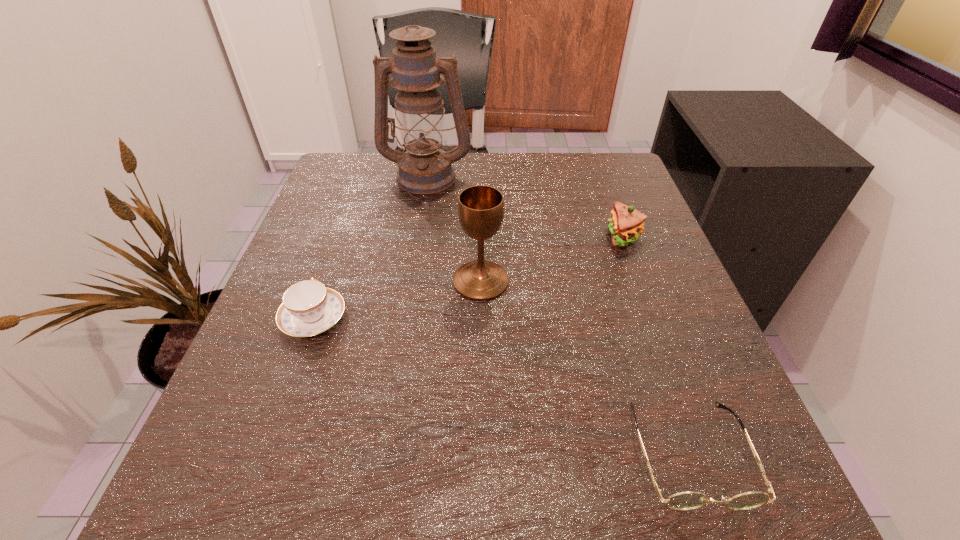
Find the location of `the tallest object`. the tallest object is located at coordinates (425, 169).

Where is `the farthest object`? Image resolution: width=960 pixels, height=540 pixels. the farthest object is located at coordinates (425, 169).

You are a GUI agent. You are given a task and a screenshot of the screen. Output one action in this format:
    pyautogui.click(x=<x>, y=<y>)
    Task: Click on the chalice
    
    Given the screenshot: What is the action you would take?
    pyautogui.click(x=480, y=208)

At what (x,y) coordinates should I click in order to perform the action: click on sandwich. Please return your answer as a coordinate pair (x, y). Image resolution: width=960 pixels, height=540 pixels. Looking at the image, I should click on (626, 224).

Identify the location of the third tallest object. The height and width of the screenshot is (540, 960). tap(626, 224).

This screenshot has width=960, height=540. In order to click on the second shortest object in this screenshot , I will do `click(309, 308)`.

Find the location of a particular element. This screenshot has width=960, height=540. spectacles is located at coordinates (685, 500).

What are the coordinates of `the shortest object` in the screenshot? It's located at (685, 500).

What are the coordinates of `free location located on the front of the farthest object` in the screenshot? It's located at (413, 260).

Where is `free space located on the back of the chalice`? free space located on the back of the chalice is located at coordinates (481, 190).